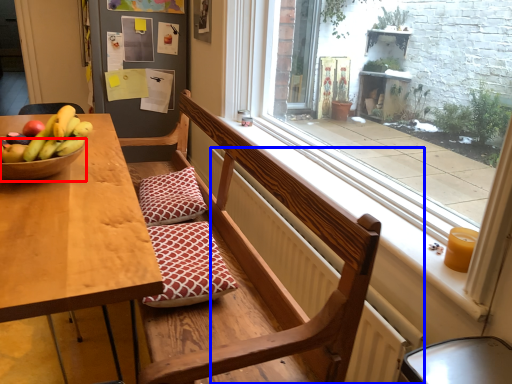
Question: Which object is closer to the camera taking this photo, glass bowl (highlighted by a red box) or radiator (highlighted by a blue box)?

Choices:
 (A) glass bowl
 (B) radiator

Answer: (B)